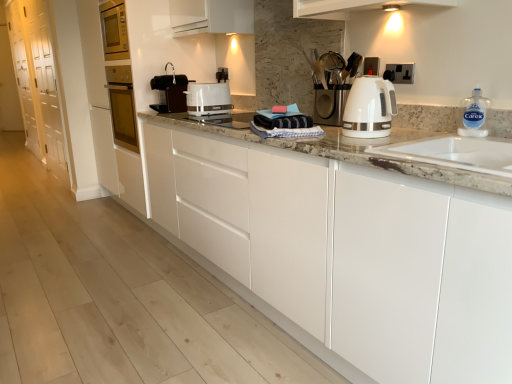
You are a GUI agent. You are given a task and a screenshot of the screen. Output one action in this format:
    pyautogui.click(x=<x>, y=<y>)
    Task: Click on the vacant space to the left of white glossy electric kettle at right, which is counted as the first home appliance, starting from the front
    Image resolution: width=512 pixels, height=384 pixels.
    Given the screenshot: What is the action you would take?
    pyautogui.click(x=327, y=139)